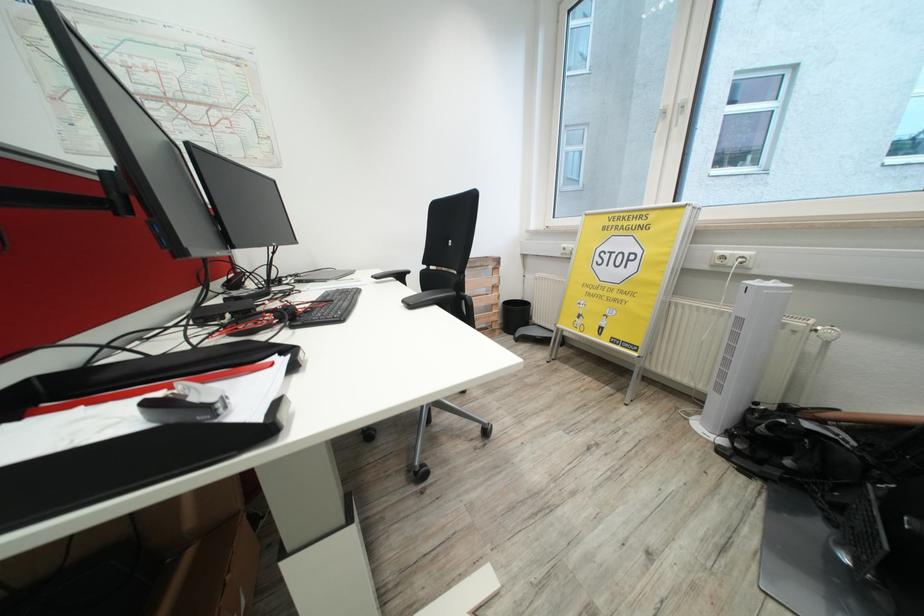
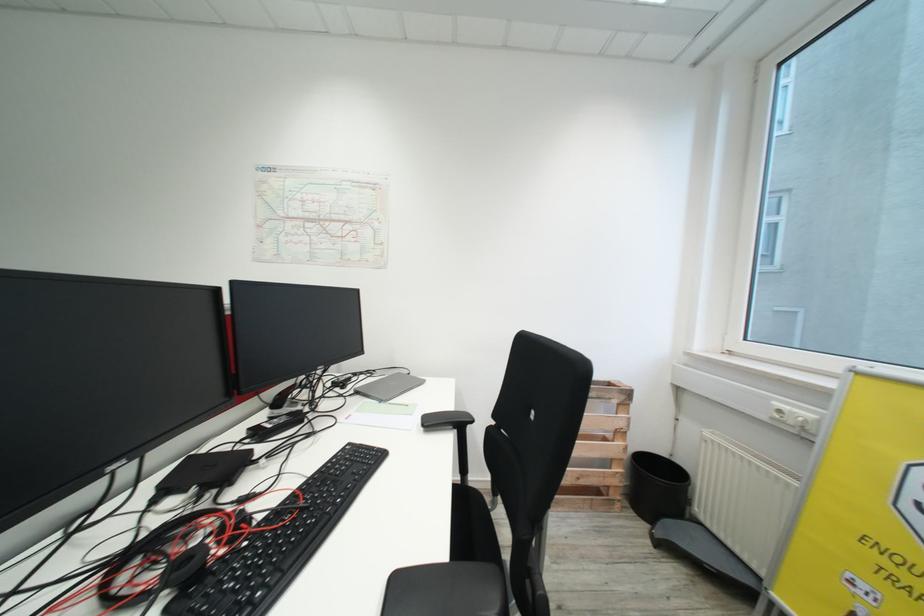
Question: The images are taken continuously from a first-person perspective. In which direction is your viewpoint rotating?

Choices:
 (A) Left
 (B) Right
 (C) Up
 (D) Down

Answer: (A)